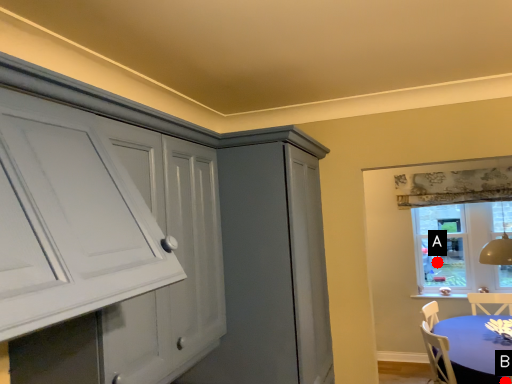
Question: Two points are circled on the image, labeled by A and B beside each circle. Which point is closer to the camera?

Choices:
 (A) A is closer
 (B) B is closer

Answer: (B)